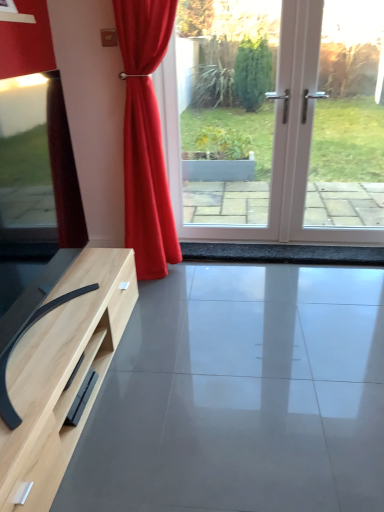
Question: Is satin red curtain at center aimed at matte wood tv stand at lower left?

Choices:
 (A) yes
 (B) no

Answer: (B)

Question: Does satin red curtain at center have a lesser height compared to matte wood tv stand at lower left?

Choices:
 (A) yes
 (B) no

Answer: (B)

Question: From a real-world perspective, is satin red curtain at center over matte wood tv stand at lower left?

Choices:
 (A) yes
 (B) no

Answer: (A)

Question: Does satin red curtain at center lie in front of matte wood tv stand at lower left?

Choices:
 (A) yes
 (B) no

Answer: (B)

Question: Are satin red curtain at center and matte wood tv stand at lower left beside each other?

Choices:
 (A) no
 (B) yes

Answer: (A)

Question: Does satin red curtain at center have a larger size compared to matte wood tv stand at lower left?

Choices:
 (A) yes
 (B) no

Answer: (A)

Question: Is the position of matte wood tv stand at lower left more distant than that of white glossy screen door at center?

Choices:
 (A) no
 (B) yes

Answer: (A)

Question: Does matte wood tv stand at lower left have a larger size compared to white glossy screen door at center?

Choices:
 (A) no
 (B) yes

Answer: (A)

Question: Does matte wood tv stand at lower left have a lesser width compared to white glossy screen door at center?

Choices:
 (A) yes
 (B) no

Answer: (B)

Question: Is matte wood tv stand at lower left positioned with its back to white glossy screen door at center?

Choices:
 (A) yes
 (B) no

Answer: (B)

Question: Is white glossy screen door at center a part of matte wood tv stand at lower left?

Choices:
 (A) yes
 (B) no

Answer: (B)

Question: Is matte wood tv stand at lower left smaller than white glossy screen door at center?

Choices:
 (A) no
 (B) yes

Answer: (B)

Question: Does matte wood tv stand at lower left have a larger size compared to satin red curtain at center?

Choices:
 (A) yes
 (B) no

Answer: (B)